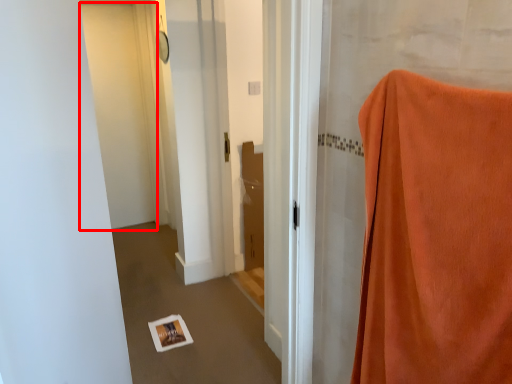
Question: Where is door (annotated by the red box) located in relation to curtain in the image?

Choices:
 (A) right
 (B) left

Answer: (B)